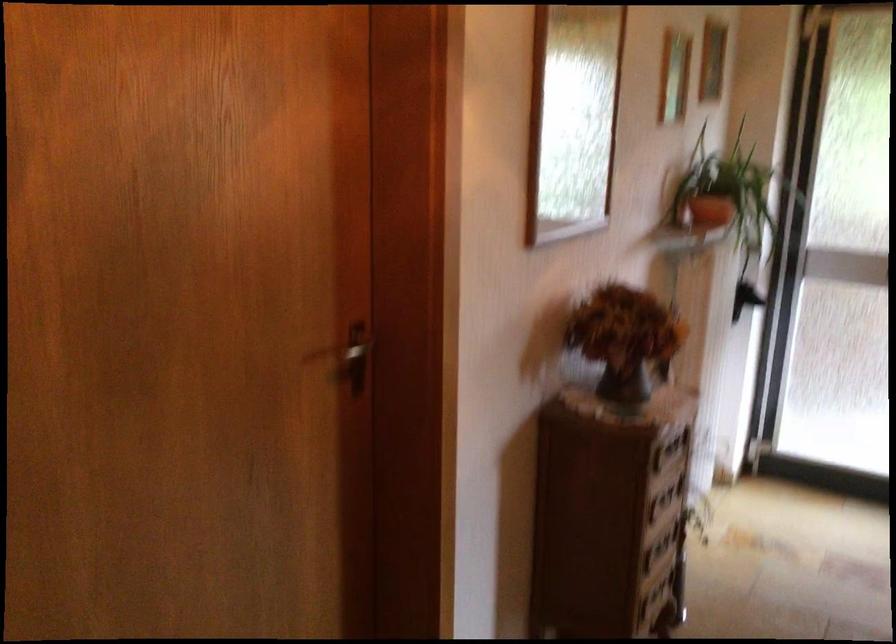
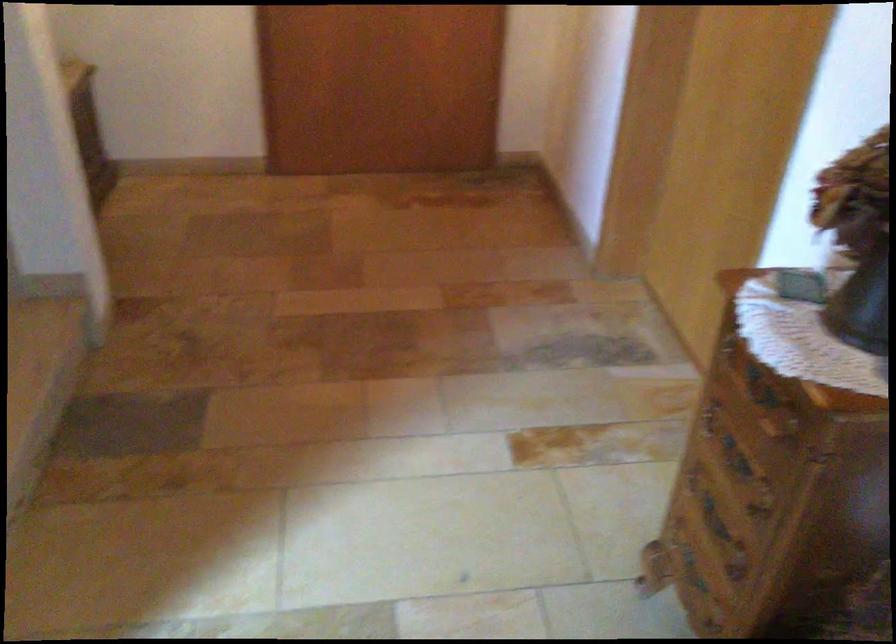
Find the pixel in the second image that matches (648,482) in the first image.

(760, 386)